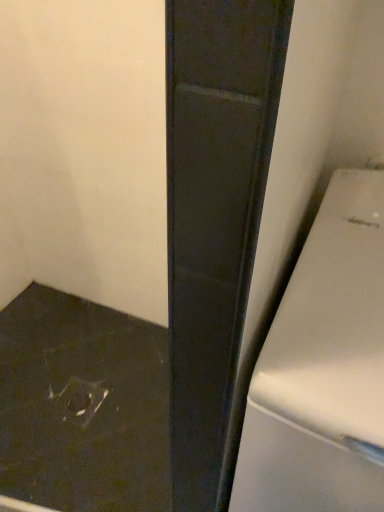
Measure the distance between white glossy toilet at right and camera.

white glossy toilet at right and camera are 51.71 centimeters apart from each other.

Locate an element on the screen. white glossy toilet at right is located at coordinates pyautogui.click(x=323, y=368).

This screenshot has height=512, width=384. What do you see at coordinates (323, 368) in the screenshot? I see `white glossy toilet at right` at bounding box center [323, 368].

Find the location of a particular element. white glossy toilet at right is located at coordinates (323, 368).